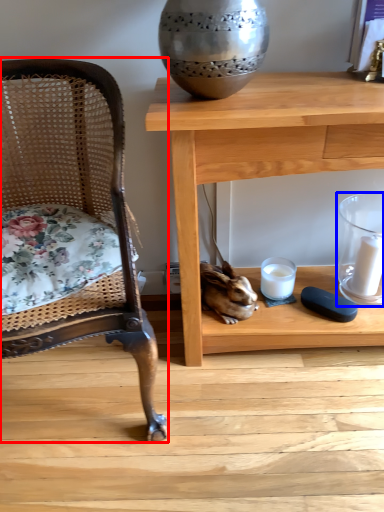
Question: Which of the following is the farthest to the observer, chair (highlighted by a red box) or candle holder (highlighted by a blue box)?

Choices:
 (A) chair
 (B) candle holder

Answer: (B)